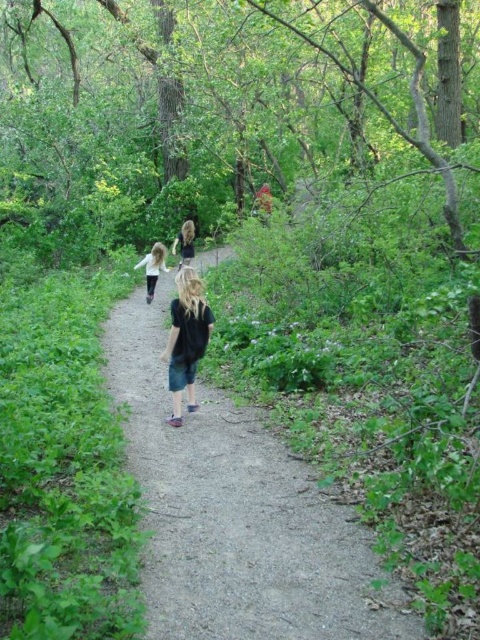
Question: Which point is closer to the camera?

Choices:
 (A) (193, 246)
 (B) (168, 269)
 (C) (208, 323)

Answer: (C)

Question: Can you confirm if denim shorts at center is thinner than white cotton shirt at center?

Choices:
 (A) no
 (B) yes

Answer: (A)

Question: Among these points, which one is farthest from the camera?

Choices:
 (A) (157, 272)
 (B) (189, 324)
 (C) (182, 246)

Answer: (C)

Question: Where is denim shorts at center located in relation to white cotton shirt at center in the image?

Choices:
 (A) below
 (B) above

Answer: (A)

Question: Does denim shorts at center appear on the left side of blonde hair at center?

Choices:
 (A) no
 (B) yes

Answer: (A)

Question: Among these points, which one is nearest to the camera?

Choices:
 (A) (172, 300)
 (B) (182, 234)

Answer: (A)